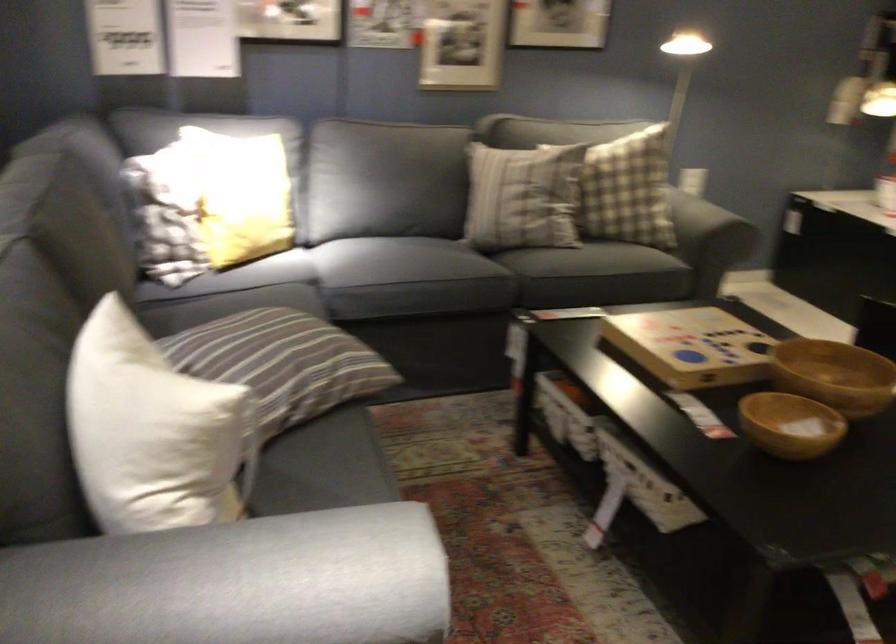
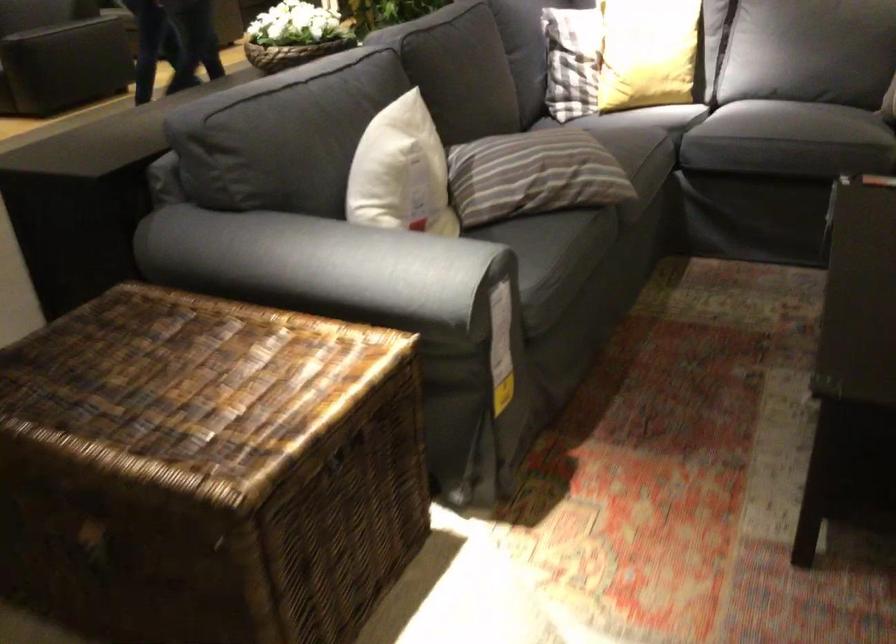
Locate, in the second image, the point that corresponds to (435,277) in the first image.

(768, 122)